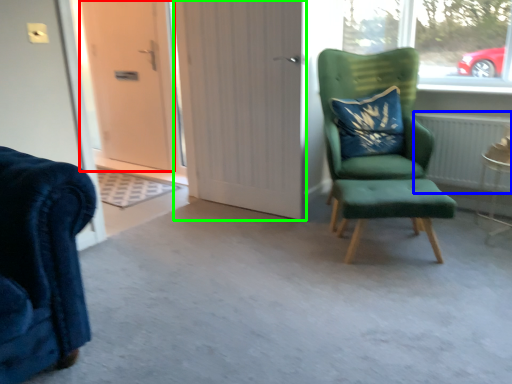
Question: Which object is positioned closest to door (highlighted by a red box)? Select from radiator (highlighted by a blue box) and door (highlighted by a green box).

Choices:
 (A) radiator
 (B) door

Answer: (B)